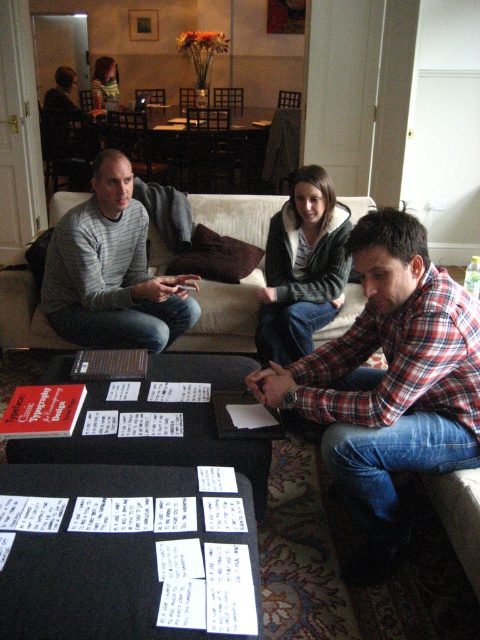
Measure the distance between point (218, 538) and camera.

4.72 feet

Is white paper cards at lower center to the left of matte gray sweater at center from the viewer's perspective?

In fact, white paper cards at lower center is to the right of matte gray sweater at center.

Image resolution: width=480 pixels, height=640 pixels. What do you see at coordinates (124, 554) in the screenshot?
I see `white paper cards at lower center` at bounding box center [124, 554].

This screenshot has width=480, height=640. Find the location of `white paper cards at lower center`. white paper cards at lower center is located at coordinates (124, 554).

Between white paper cards at lower center and striped hoodie at center, which one has less height?

→ Standing shorter between the two is white paper cards at lower center.

Between white paper cards at lower center and striped hoodie at center, which one is positioned lower?

white paper cards at lower center is lower down.

Does point (50, 588) lie in front of point (334, 243)?

Yes, it is in front of point (334, 243).

In order to click on white paper cards at lower center in this screenshot , I will do `click(124, 554)`.

Does plaid flannel shirt at center have a greater width compared to beige fabric couch at center?

Correct, the width of plaid flannel shirt at center exceeds that of beige fabric couch at center.

Is plaid flannel shirt at center in front of beige fabric couch at center?

Yes.

Between point (433, 390) and point (248, 314), which one is positioned behind?

The point (248, 314) is behind.

Where is `plaid flannel shirt at center`? The height and width of the screenshot is (640, 480). plaid flannel shirt at center is located at coordinates (389, 378).